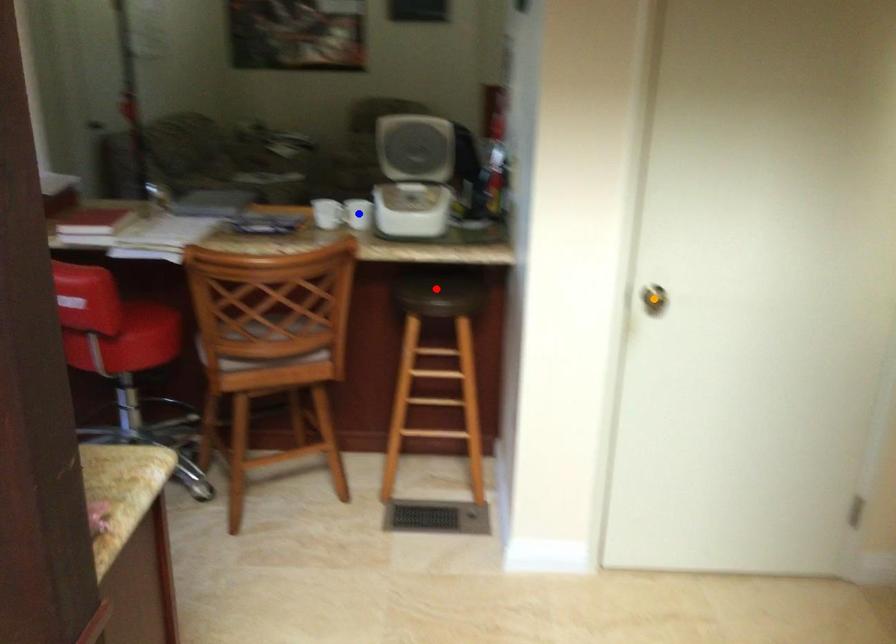
Order these from farthest to nearest:
A) blue point
B) red point
C) orange point

blue point < red point < orange point